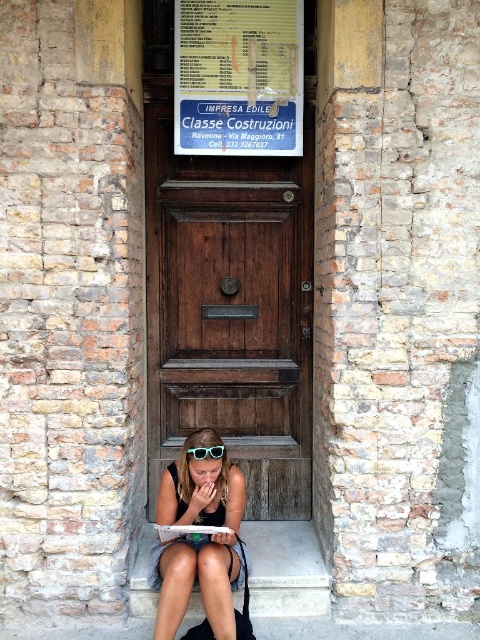
Question: Is the position of matte blue sunglasses at lower center more distant than that of teal plastic goggles at center?

Choices:
 (A) yes
 (B) no

Answer: (B)

Question: Observing the image, what is the correct spatial positioning of smooth concrete stairs at lower center in reference to teal plastic goggles at center?

Choices:
 (A) below
 (B) above

Answer: (A)

Question: Which object is the farthest from the wooden door at center?

Choices:
 (A) matte blue sunglasses at lower center
 (B) smooth concrete stairs at lower center
 (C) teal plastic goggles at center

Answer: (C)

Question: Considering the real-world distances, which object is farthest from the smooth concrete stairs at lower center?

Choices:
 (A) wooden door at center
 (B) matte blue sunglasses at lower center

Answer: (A)

Question: Does matte blue sunglasses at lower center have a greater width compared to teal plastic goggles at center?

Choices:
 (A) no
 (B) yes

Answer: (B)

Question: Which of these objects is positioned closest to the matte blue sunglasses at lower center?

Choices:
 (A) smooth concrete stairs at lower center
 (B) wooden door at center
 (C) teal plastic goggles at center

Answer: (C)